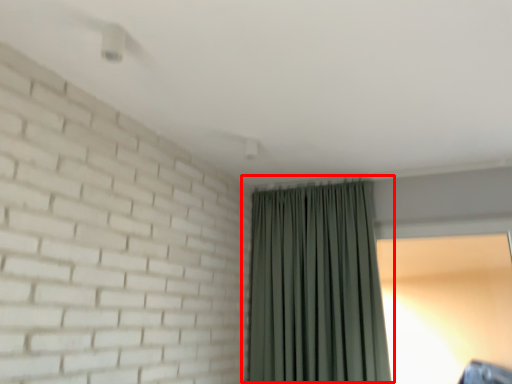
Question: In this image, where is curtain (annotated by the red box) located relative to window screen?

Choices:
 (A) right
 (B) left

Answer: (B)